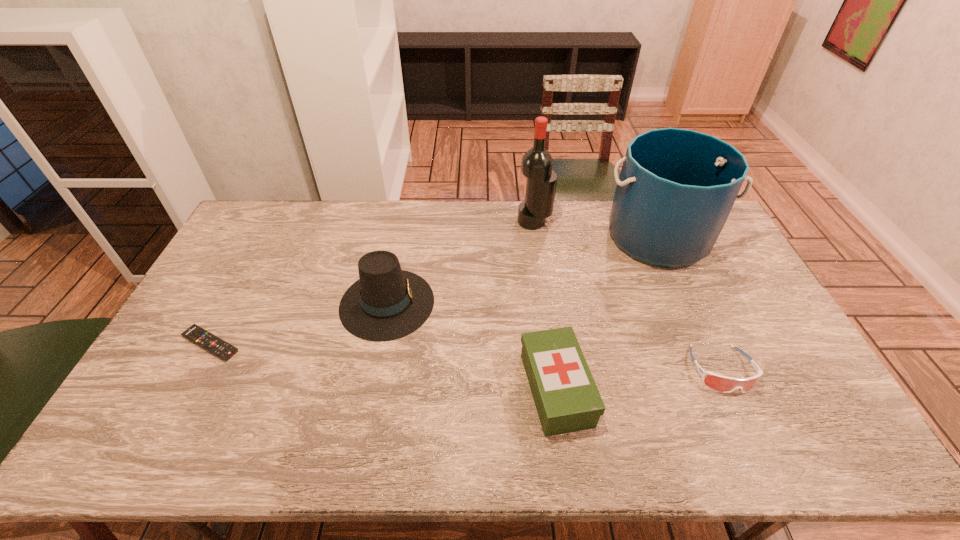
Where is `blank region between the leftmost object and the first-aid kit`? The height and width of the screenshot is (540, 960). blank region between the leftmost object and the first-aid kit is located at coordinates (383, 367).

Where is `free space between the remote control and the bucket`? free space between the remote control and the bucket is located at coordinates (435, 291).

Image resolution: width=960 pixels, height=540 pixels. Find the location of `unoccupied area between the fifth object from right to left and the tallest object`. unoccupied area between the fifth object from right to left and the tallest object is located at coordinates (461, 262).

I want to click on unoccupied position between the tallest object and the goggles, so (x=628, y=296).

Where is `unoccupied area between the second tallest object and the goggles`? unoccupied area between the second tallest object and the goggles is located at coordinates (690, 303).

Image resolution: width=960 pixels, height=540 pixels. What are the coordinates of `unoccupied position between the bucket and the shortest object` in the screenshot? It's located at tap(435, 291).

In order to click on free spot between the goggles and the third shortest object in this screenshot , I will do `click(638, 380)`.

Where is `object that is the third closest to the fourth shortest object`? This screenshot has width=960, height=540. object that is the third closest to the fourth shortest object is located at coordinates (537, 163).

Where is `the third closest object to the wine bottle`? the third closest object to the wine bottle is located at coordinates (566, 397).

You are a GUI agent. You are given a task and a screenshot of the screen. Output one action in this format:
    pyautogui.click(x=<x>, y=<y>)
    Task: Click on the vacant region that satisfies the following two spatial constraints: 1. on the front-facing side of the first-aid kit; 2. on the left side of the hat
    This screenshot has width=960, height=540.
    Given the screenshot: What is the action you would take?
    pyautogui.click(x=370, y=389)